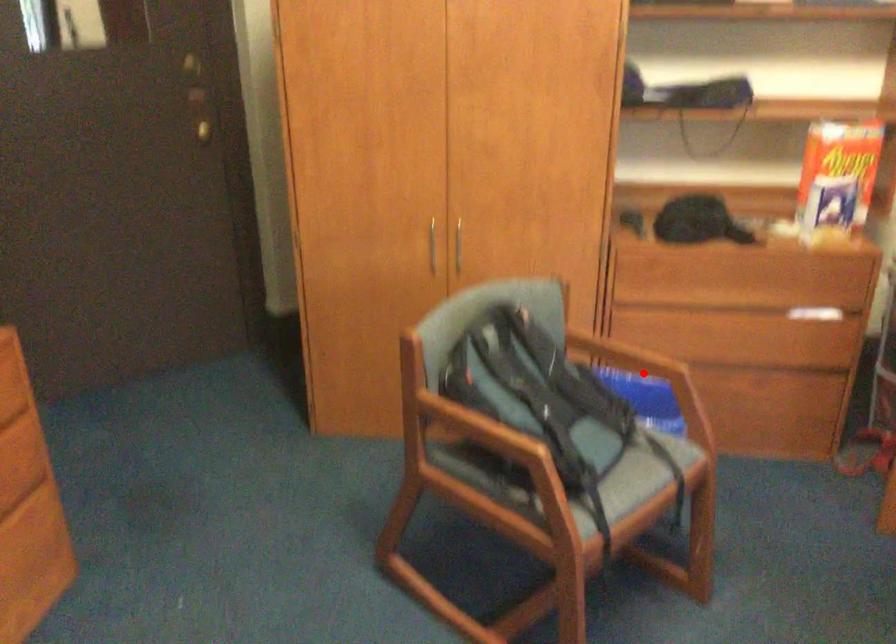
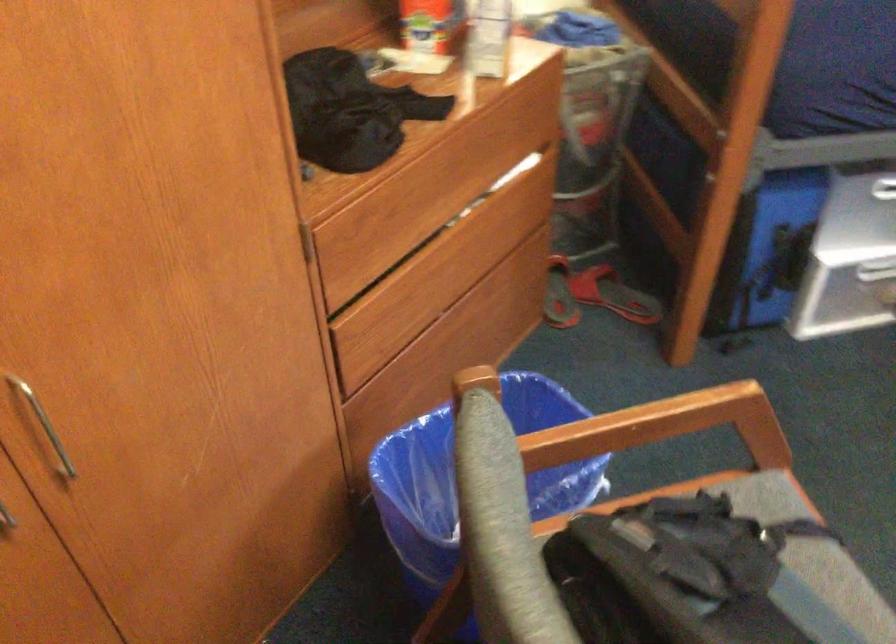
Question: I am providing you with two images of the same scene from different viewpoints. A red point is shown in image1. For the corresponding object point in image2, is it positioned nearer or farther from the camera?

Choices:
 (A) Nearer
 (B) Farther

Answer: (A)